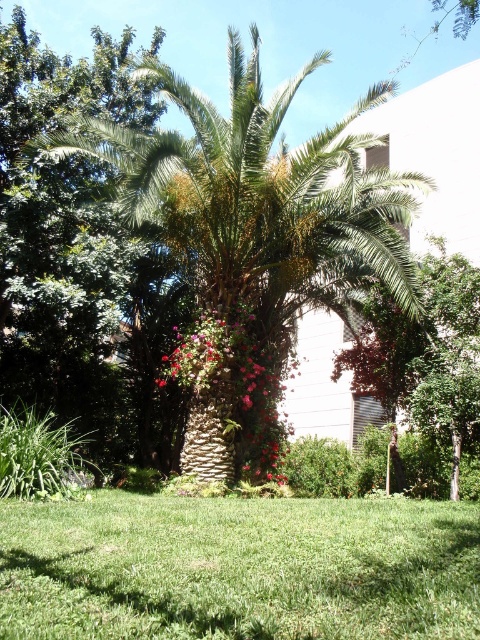
Question: Which object appears closest to the camera in this image?

Choices:
 (A) pink textured flowers at center
 (B) green leafy tree at center
 (C) green textured palm tree at center
 (D) green grass at center

Answer: (D)

Question: Can you confirm if green textured palm tree at center is thinner than green leafy tree at center?

Choices:
 (A) no
 (B) yes

Answer: (A)

Question: Which of these objects is positioned closest to the green textured palm tree at center?

Choices:
 (A) pink textured flowers at center
 (B) green grass at center
 (C) green leafy tree at center

Answer: (A)

Question: Which point appears farthest from the camera in this image?

Choices:
 (A) (196, 509)
 (B) (213, 477)
 (C) (360, 348)

Answer: (C)

Question: Can you confirm if green textured palm tree at center is wider than green grass at center?

Choices:
 (A) yes
 (B) no

Answer: (A)

Question: Can you confirm if green textured palm tree at center is positioned to the right of green grass at center?

Choices:
 (A) yes
 (B) no

Answer: (A)